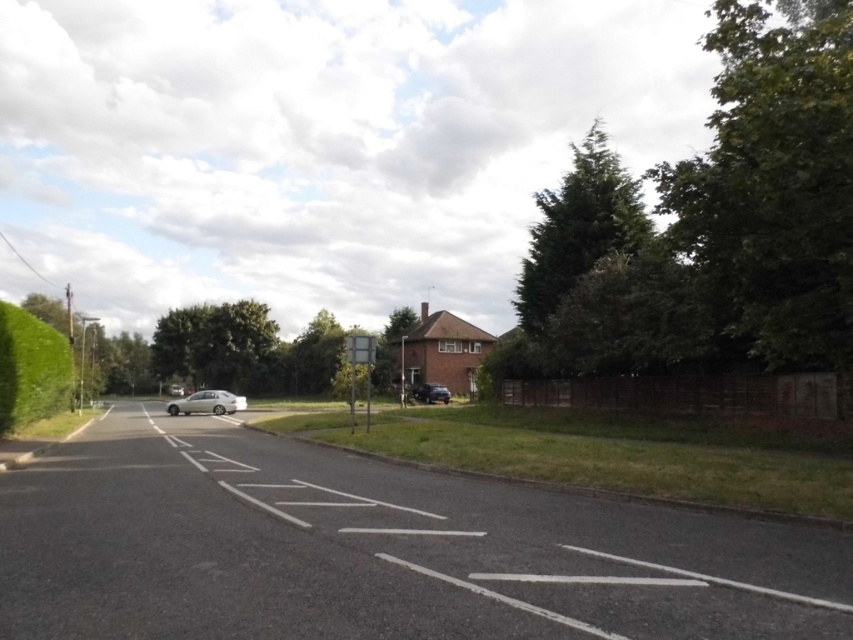
Does metallic gray street sign at center appear over shiny black car at center?

Yes, metallic gray street sign at center is above shiny black car at center.

Describe the element at coordinates (360, 364) in the screenshot. The height and width of the screenshot is (640, 853). I see `metallic gray street sign at center` at that location.

What do you see at coordinates (360, 364) in the screenshot?
I see `metallic gray street sign at center` at bounding box center [360, 364].

Find the location of a particular element. The image size is (853, 640). metallic gray street sign at center is located at coordinates (360, 364).

Between green leafy tree at left and green leafy tree at center, which one has more height?

Standing taller between the two is green leafy tree at center.

The width and height of the screenshot is (853, 640). Describe the element at coordinates (126, 364) in the screenshot. I see `green leafy tree at left` at that location.

This screenshot has width=853, height=640. What are the coordinates of `green leafy tree at left` in the screenshot? It's located at (126, 364).

Can you confirm if green leafy tree at upper right is positioned to the left of green leafy hedge at left?

In fact, green leafy tree at upper right is to the right of green leafy hedge at left.

In the scene shown: Is green leafy tree at upper right taller than green leafy hedge at left?

Yes.

In order to click on green leafy tree at upper right in this screenshot , I will do `click(579, 227)`.